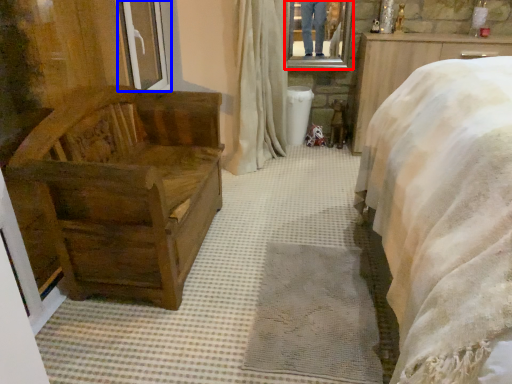
Question: Which of the following is the closest to the observer, mirror (highlighted by a red box) or window frame (highlighted by a blue box)?

Choices:
 (A) mirror
 (B) window frame

Answer: (B)